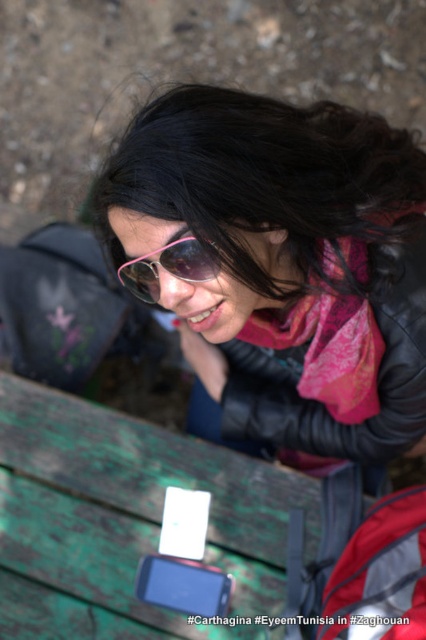
Question: Which point is farther to the camera?

Choices:
 (A) green weathered wood picnic table at lower left
 (B) pink reflective sunglasses at center
 (C) leather jacket at center

Answer: (A)

Question: Which point is closer to the camera taking this photo?

Choices:
 (A) coord(216,544)
 (B) coord(399,376)
 (C) coord(172,253)
 (D) coord(268,358)

Answer: (C)

Question: Does matte black jacket at center come behind pink reflective sunglasses at center?

Choices:
 (A) no
 (B) yes

Answer: (A)

Question: Where is matte black jacket at center located in relation to leather jacket at center in the image?

Choices:
 (A) right
 (B) left

Answer: (B)

Question: Does matte black jacket at center appear under leather jacket at center?

Choices:
 (A) no
 (B) yes

Answer: (A)

Question: Which point is farther from the camera taking this photo?

Choices:
 (A) (350, 161)
 (B) (370, 416)
 (C) (163, 259)
 (D) (271, 472)

Answer: (D)